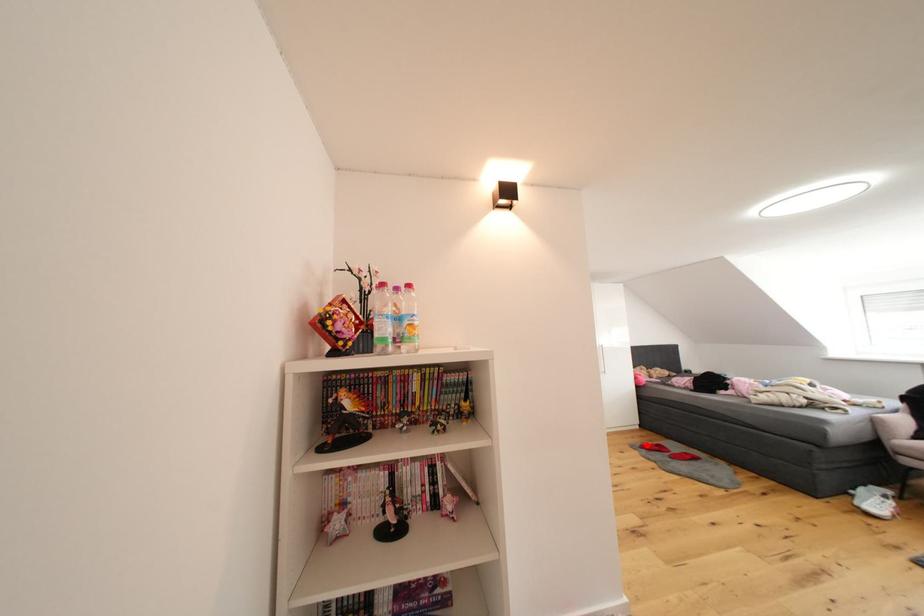
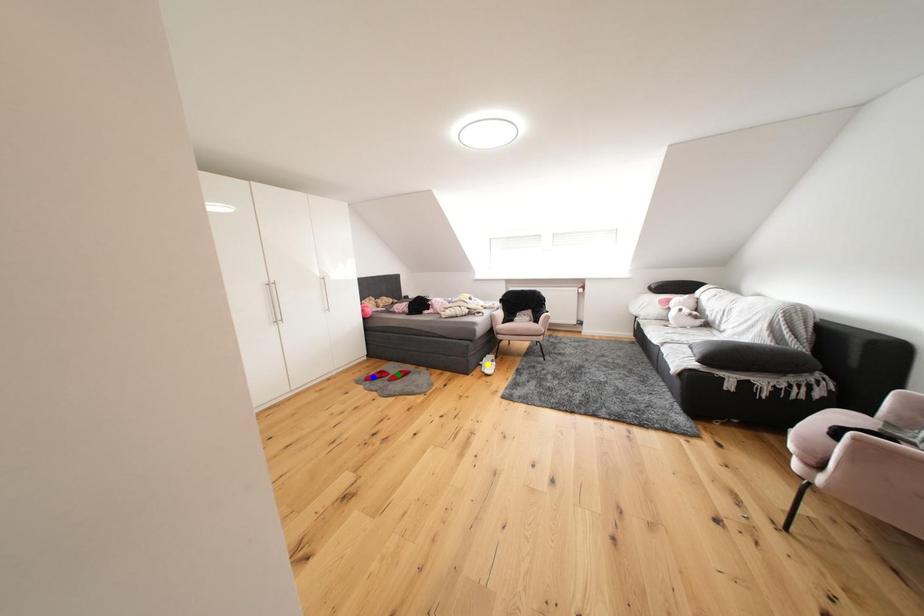
Question: I am providing you with two images of the same scene from different viewpoints. A red point is marked on the first image. You are given multiple points on the second image. Which spot in image 2 lines up with the point in image 1?

Choices:
 (A) yellow point
 (B) green point
 (C) blue point

Answer: (C)